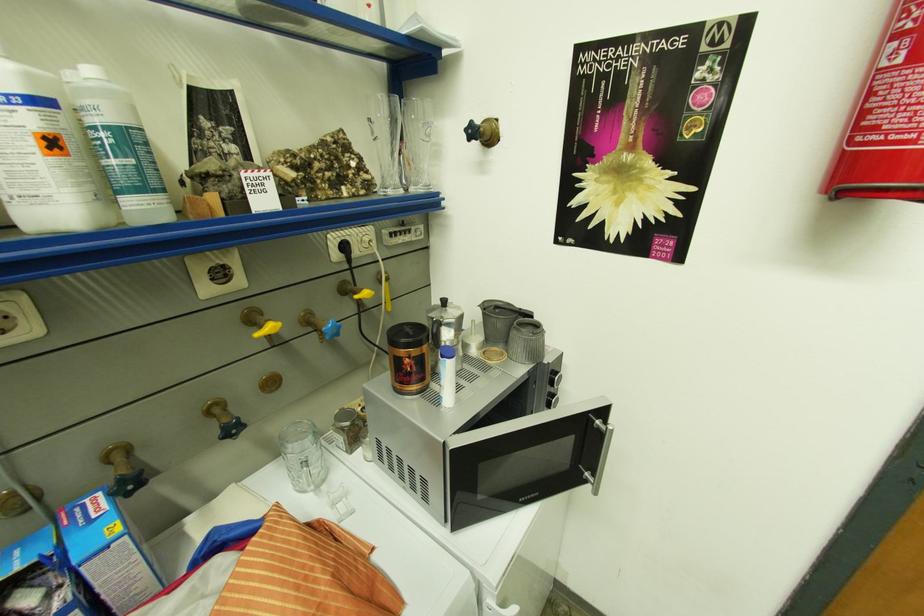
The image size is (924, 616). In order to click on refrigerator door handle in this screenshot , I will do `click(462, 308)`.